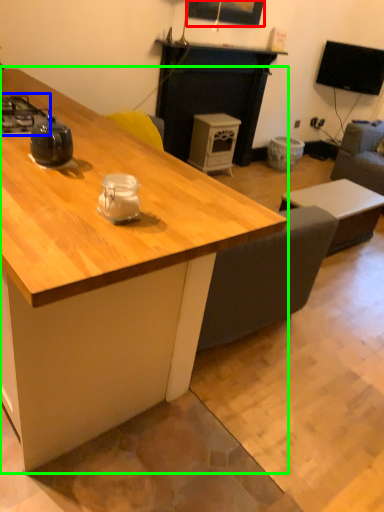
Question: Which is nearer to the picture frame (highlighted by a red box)? gas stove (highlighted by a blue box) or desk (highlighted by a green box).

Choices:
 (A) gas stove
 (B) desk

Answer: (A)